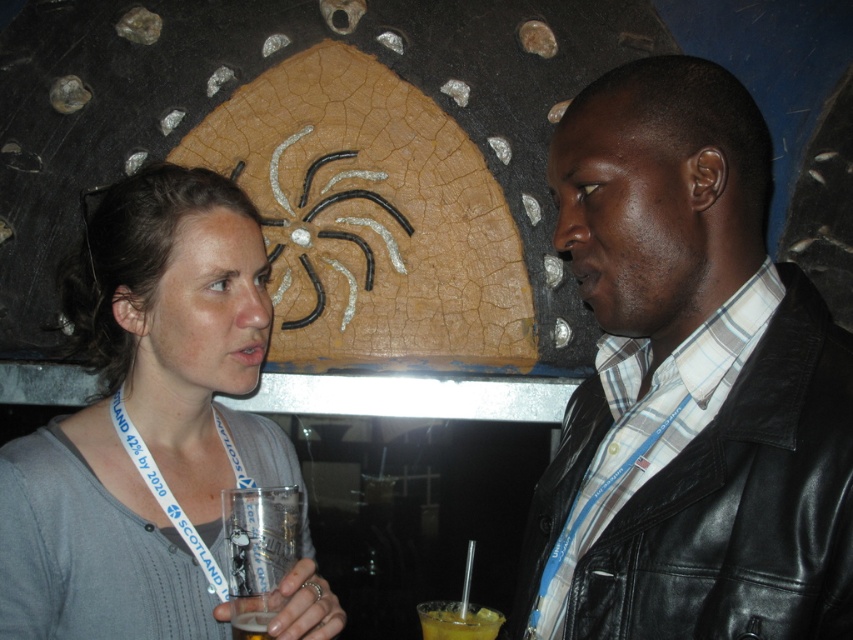
Does clear plastic cup at lower left appear on the right side of translucent plastic cup at lower left?

Indeed, clear plastic cup at lower left is positioned on the right side of translucent plastic cup at lower left.

Who is taller, clear plastic cup at lower left or translucent plastic cup at lower left?

clear plastic cup at lower left is taller.

Which is behind, point (285, 490) or point (250, 618)?

The point (285, 490) is more distant.

You are a GUI agent. You are given a task and a screenshot of the screen. Output one action in this format:
    pyautogui.click(x=<x>, y=<y>)
    Task: Click on the clear plastic cup at lower left
    This screenshot has width=853, height=640.
    Given the screenshot: What is the action you would take?
    pyautogui.click(x=258, y=552)

Between black leather jacket at center and gray cotton shirt at left, which one appears on the right side from the viewer's perspective?

Positioned to the right is black leather jacket at center.

How far apart are black leather jacket at center and gray cotton shirt at left?

black leather jacket at center and gray cotton shirt at left are 17.84 inches apart from each other.

Find the location of a particular element. Image resolution: width=853 pixels, height=640 pixels. black leather jacket at center is located at coordinates (688, 385).

Who is positioned more to the right, black leather jacket at center or clear plastic cup at lower left?

Positioned to the right is black leather jacket at center.

Can you confirm if black leather jacket at center is positioned to the left of clear plastic cup at lower left?

Incorrect, black leather jacket at center is not on the left side of clear plastic cup at lower left.

Which is in front, point (763, 595) or point (230, 573)?

Point (763, 595) is in front.

You are a GUI agent. You are given a task and a screenshot of the screen. Output one action in this format:
    pyautogui.click(x=<x>, y=<y>)
    Task: Click on the black leather jacket at center
    The height and width of the screenshot is (640, 853).
    Given the screenshot: What is the action you would take?
    pyautogui.click(x=688, y=385)